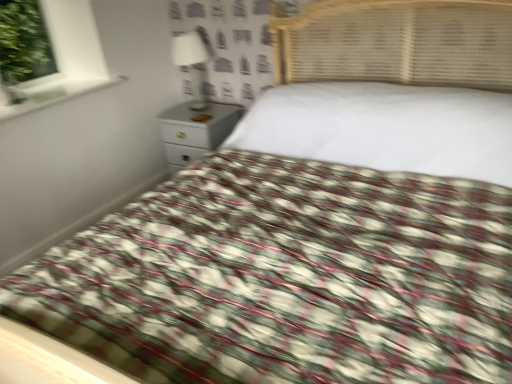
Question: Is white glossy window sill at upper left to the right of white glossy lamp at upper center from the viewer's perspective?

Choices:
 (A) no
 (B) yes

Answer: (A)

Question: From the image's perspective, is white glossy window sill at upper left under white glossy lamp at upper center?

Choices:
 (A) yes
 (B) no

Answer: (A)

Question: Is white glossy window sill at upper left outside white glossy lamp at upper center?

Choices:
 (A) yes
 (B) no

Answer: (A)

Question: From a real-world perspective, is white glossy window sill at upper left below white glossy lamp at upper center?

Choices:
 (A) yes
 (B) no

Answer: (B)

Question: Is white glossy window sill at upper left thinner than white glossy lamp at upper center?

Choices:
 (A) no
 (B) yes

Answer: (A)

Question: Is white glossy window sill at upper left wider than white glossy lamp at upper center?

Choices:
 (A) no
 (B) yes

Answer: (B)

Question: Is white glossy nightstand at upper center bigger than white glossy lamp at upper center?

Choices:
 (A) no
 (B) yes

Answer: (B)

Question: From a real-world perspective, is white glossy nightstand at upper center over white glossy lamp at upper center?

Choices:
 (A) yes
 (B) no

Answer: (B)

Question: Does white glossy nightstand at upper center appear on the left side of white glossy lamp at upper center?

Choices:
 (A) no
 (B) yes

Answer: (A)

Question: Is white glossy nightstand at upper center positioned in front of white glossy lamp at upper center?

Choices:
 (A) yes
 (B) no

Answer: (B)

Question: Does white glossy nightstand at upper center have a lesser height compared to white glossy lamp at upper center?

Choices:
 (A) yes
 (B) no

Answer: (B)

Question: From the image's perspective, does white glossy nightstand at upper center appear higher than white glossy lamp at upper center?

Choices:
 (A) yes
 (B) no

Answer: (B)

Question: Is white glossy nightstand at upper center positioned with its back to white glossy window sill at upper left?

Choices:
 (A) no
 (B) yes

Answer: (A)